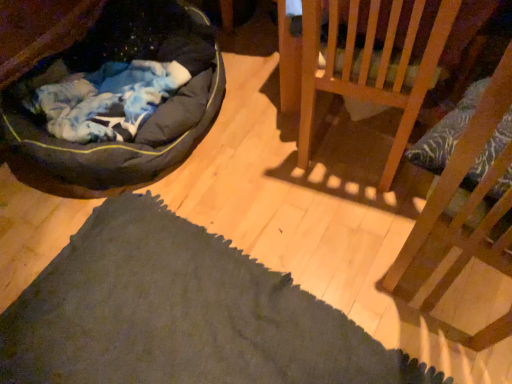
Identify the location of free region under wooden chair at upper right, which is the 2th furniture in front-to-back order (from a real-world perspective). (362, 119).